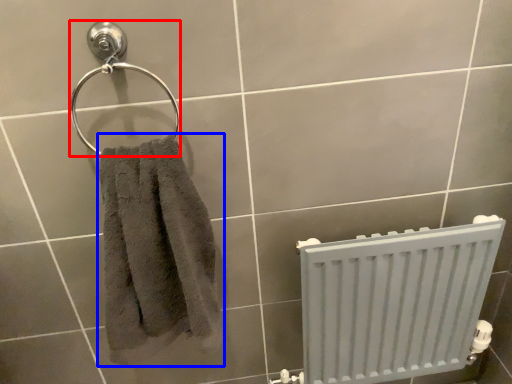
Question: Which point is closer to the camera, towel bar (highlighted by a red box) or towel (highlighted by a blue box)?

Choices:
 (A) towel bar
 (B) towel

Answer: (B)